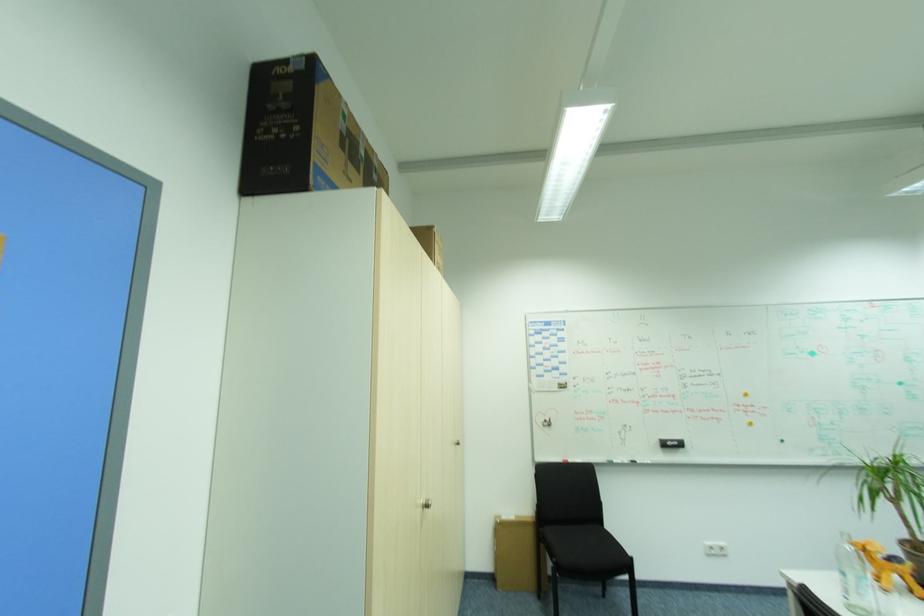
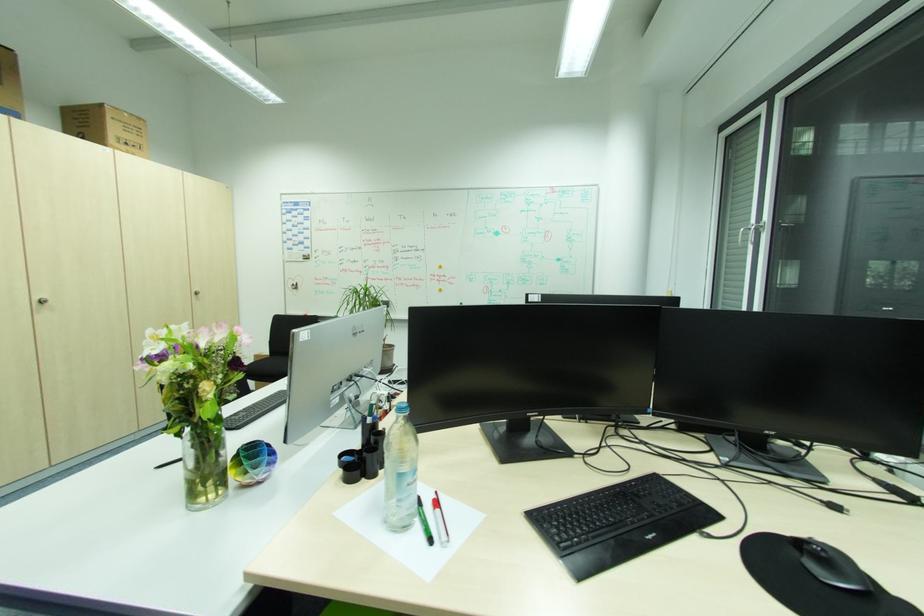
Locate, in the second image, the point that corresponds to (464,444) in the first image.

(202, 293)